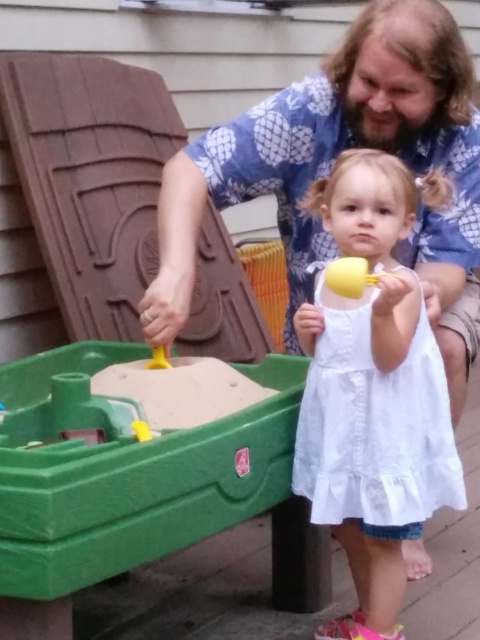
Question: Is white lace dress at center thinner than yellow plastic shovel at lower center?

Choices:
 (A) yes
 (B) no

Answer: (B)

Question: Observing the image, what is the correct spatial positioning of white lace dress at center in reference to yellow plastic shovel at lower center?

Choices:
 (A) right
 (B) left

Answer: (A)

Question: Is white lace dress at center to the right of yellow plastic shovel at lower center from the viewer's perspective?

Choices:
 (A) yes
 (B) no

Answer: (A)